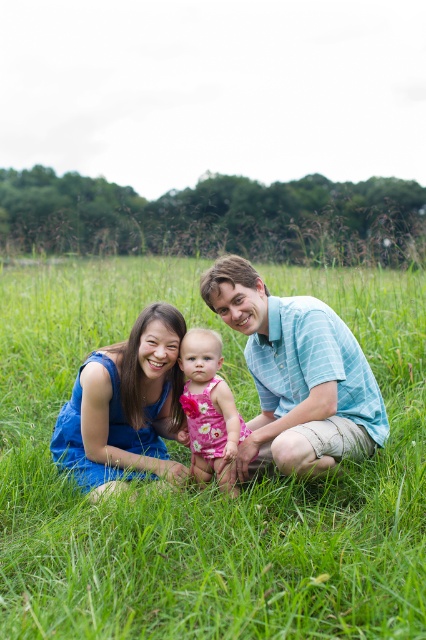
Question: Which of the following is the farthest from the observer?

Choices:
 (A) pink floral dress at center
 (B) blue striped shirt at center

Answer: (A)

Question: Can you confirm if green grass at center is positioned to the right of blue fabric dress at center?

Choices:
 (A) yes
 (B) no

Answer: (A)

Question: Is blue striped shirt at center wider than blue fabric dress at center?

Choices:
 (A) yes
 (B) no

Answer: (A)

Question: Which of the following is the closest to the observer?

Choices:
 (A) (224, 472)
 (B) (144, 330)
 (C) (219, 268)

Answer: (A)

Question: Among these objects, which one is farthest from the camera?

Choices:
 (A) blue striped shirt at center
 (B) blue fabric dress at center
 (C) green grass at center

Answer: (B)

Question: Is blue fabric dress at center bigger than pink floral dress at center?

Choices:
 (A) yes
 (B) no

Answer: (A)